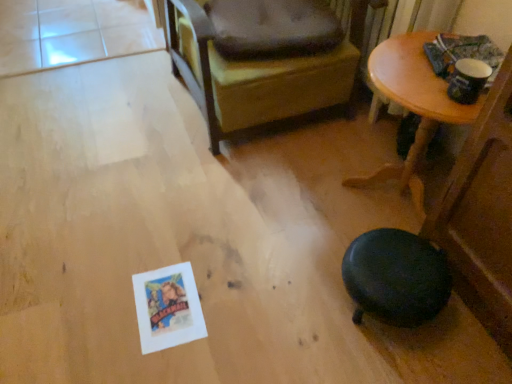
Locate an element on the screen. The width and height of the screenshot is (512, 384). dark brown leather chair at center is located at coordinates (259, 60).

From a real-world perspective, who is located lower, wooden table at upper right or dark brown leather chair at center?

wooden table at upper right, from a real-world perspective.

Can you see wooden table at upper right touching dark brown leather chair at center?

No, wooden table at upper right is not next to dark brown leather chair at center.

Is wooden table at upper right positioned with its back to dark brown leather chair at center?

No, wooden table at upper right's orientation is not away from dark brown leather chair at center.

Is wooden table at upper right bigger or smaller than dark brown leather chair at center?

Clearly, wooden table at upper right is smaller in size than dark brown leather chair at center.

Considering the positions of objects dark brown fabric dog bed at upper center and dark brown leather chair at center in the image provided, who is more to the left, dark brown fabric dog bed at upper center or dark brown leather chair at center?

From the viewer's perspective, dark brown leather chair at center appears more on the left side.

Is dark brown fabric dog bed at upper center touching dark brown leather chair at center?

Yes, the surface of dark brown fabric dog bed at upper center is in contact with dark brown leather chair at center.

Between dark brown fabric dog bed at upper center and dark brown leather chair at center, which one is positioned in front?

Positioned in front is dark brown leather chair at center.

How different are the orientations of dark brown fabric dog bed at upper center and dark brown leather chair at center in degrees?

A: They differ by 13.1 degrees in their facing directions.

Is dark brown fabric dog bed at upper center at the back of dark brown leather chair at center?

Yes, dark brown leather chair at center is positioned with its back facing dark brown fabric dog bed at upper center.

In the image, is dark brown leather chair at center on the left side or the right side of dark brown fabric dog bed at upper center?

dark brown leather chair at center is positioned on dark brown fabric dog bed at upper center's left side.

From a real-world perspective, is dark brown leather chair at center positioned above or below dark brown fabric dog bed at upper center?

From a real-world perspective, dark brown leather chair at center is physically below dark brown fabric dog bed at upper center.

Is the depth of dark brown leather chair at center greater than that of dark brown fabric dog bed at upper center?

No.

Between dark brown leather chair at center and wooden table at upper right, which one has less height?

wooden table at upper right is shorter.

Which object is further away from the camera, dark brown leather chair at center or wooden table at upper right?

dark brown leather chair at center is behind.

From a real-world perspective, is dark brown leather chair at center over wooden table at upper right?

Yes.

Which is farther, [249,5] or [423,71]?

Point [249,5]

How far apart are wooden table at upper right and dark brown fabric dog bed at upper center?

They are 18.82 inches apart.

From the picture: From the image's perspective, is wooden table at upper right located beneath dark brown fabric dog bed at upper center?

Correct, wooden table at upper right appears lower than dark brown fabric dog bed at upper center in the image.

Does point (402, 167) come farther from viewer compared to point (323, 1)?

Yes, it is behind point (323, 1).

Considering the positions of objects wooden table at upper right and dark brown fabric dog bed at upper center in the image provided, who is more to the left, wooden table at upper right or dark brown fabric dog bed at upper center?

From the viewer's perspective, dark brown fabric dog bed at upper center appears more on the left side.

Does point (276, 56) come in front of point (419, 47)?

That is False.

Is dark brown fabric dog bed at upper center shorter than wooden table at upper right?

Correct, dark brown fabric dog bed at upper center is not as tall as wooden table at upper right.

Is dark brown fabric dog bed at upper center oriented away from wooden table at upper right?

No.

From the image's perspective, which object appears higher, dark brown fabric dog bed at upper center or wooden table at upper right?

dark brown fabric dog bed at upper center is shown above in the image.

Identify the location of chair on the left of wooden table at upper right. (259, 60).

At what (x,y) coordinates should I click in order to perform the action: click on dog bed above the dark brown leather chair at center (from a real-world perspective). Please return your answer as a coordinate pair (x, y). Looking at the image, I should click on click(x=273, y=28).

From the image, which object appears to be farther from dark brown fabric dog bed at upper center, dark brown leather chair at center or wooden table at upper right?

wooden table at upper right is positioned further to the anchor dark brown fabric dog bed at upper center.

When comparing their distances from dark brown leather chair at center, does dark brown fabric dog bed at upper center or wooden table at upper right seem further?

wooden table at upper right.

Which object lies further to the anchor point wooden table at upper right, dark brown fabric dog bed at upper center or dark brown leather chair at center?

The object further to wooden table at upper right is dark brown leather chair at center.

Considering their positions, is wooden table at upper right positioned further to dark brown leather chair at center than dark brown fabric dog bed at upper center?

The object further to dark brown leather chair at center is wooden table at upper right.

Based on their spatial positions, is wooden table at upper right or dark brown leather chair at center further from dark brown fabric dog bed at upper center?

wooden table at upper right is further to dark brown fabric dog bed at upper center.

From the image, which object appears to be farther from wooden table at upper right, dark brown leather chair at center or dark brown fabric dog bed at upper center?

dark brown leather chair at center is further to wooden table at upper right.

Locate an element on the screen. The height and width of the screenshot is (384, 512). dog bed between dark brown leather chair at center and wooden table at upper right is located at coordinates (273, 28).